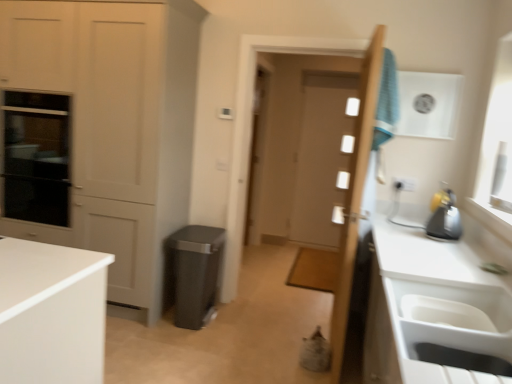
Question: Is blue fabric laundry at upper right inside or outside of wooden door at center, the 2th door in the back-to-front sequence?

Choices:
 (A) outside
 (B) inside

Answer: (A)

Question: Does point (390, 74) appear closer or farther from the camera than point (375, 33)?

Choices:
 (A) farther
 (B) closer

Answer: (B)

Question: Estimate the real-world distances between objects in this image. Which object is closer to the clear glass screen door at center?

Choices:
 (A) black glass oven at left
 (B) white plastic sink at lower right
 (C) wooden door at center, arranged as the 1th door when viewed from the front
 (D) blue fabric laundry at upper right
 (E) white glossy door at center, the second door when ordered from front to back

Answer: (E)

Question: Considering the real-world distances, which object is closest to the white glossy door at center, the second door when ordered from front to back?

Choices:
 (A) white plastic sink at lower right
 (B) blue fabric laundry at upper right
 (C) matte white cabinet at left
 (D) wooden door at center, arranged as the 1th door when viewed from the front
 (E) matte plastic trash can at center

Answer: (E)